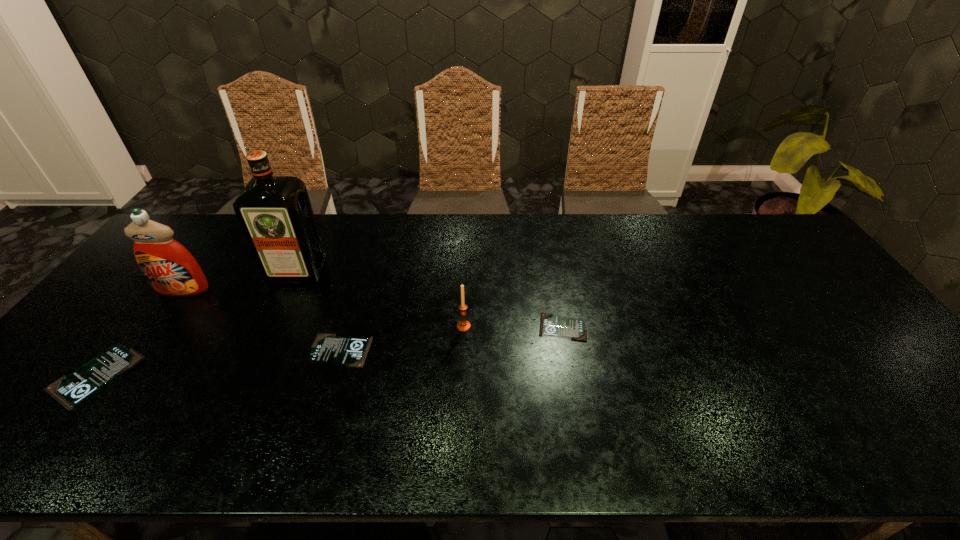
You are a GUI agent. You are given a task and a screenshot of the screen. Output one action in this format:
    pyautogui.click(x=<x>, y=<y>)
    Task: Click on the vacant area that lies between the leftmost identity card and the second object from right to left
    This screenshot has width=960, height=540.
    Given the screenshot: What is the action you would take?
    pyautogui.click(x=279, y=352)

Where is `vacant area between the rightmost identity card and the second shortest object`? The width and height of the screenshot is (960, 540). vacant area between the rightmost identity card and the second shortest object is located at coordinates (451, 339).

The height and width of the screenshot is (540, 960). Find the location of `free space between the detergent and the fourth shortest object`. free space between the detergent and the fourth shortest object is located at coordinates (324, 308).

I want to click on object that is the second closest to the second tallest identity card, so click(463, 325).

Identify which object is located as the fifth nearest to the leftmost identity card. Please provide its 2D coordinates. Your answer should be formatted as a tuple, i.e. [(x, y)], where the tuple contains the x and y coordinates of a point satisfying the conditions above.

[(550, 325)]

Select which identity card is the second closest to the second tallest identity card. Please provide its 2D coordinates. Your answer should be formatted as a tuple, i.e. [(x, y)], where the tuple contains the x and y coordinates of a point satisfying the conditions above.

[(550, 325)]

Locate which identity card ranks in proximity to the third object from left to right. Please provide its 2D coordinates. Your answer should be formatted as a tuple, i.e. [(x, y)], where the tuple contains the x and y coordinates of a point satisfying the conditions above.

[(327, 348)]

Where is `vacant space that satisfies the following two spatial constraints: 1. on the front label of the liquor; 2. on the right side of the shortest identity card`? This screenshot has width=960, height=540. vacant space that satisfies the following two spatial constraints: 1. on the front label of the liquor; 2. on the right side of the shortest identity card is located at coordinates (272, 327).

At what (x,y) coordinates should I click in order to perform the action: click on free space in the image that satisfies the following two spatial constraints: 1. on the front surface of the second object from right to left; 2. on the left side of the detergent. Please return your answer as a coordinate pair (x, y). Looking at the image, I should click on (156, 326).

The height and width of the screenshot is (540, 960). What are the coordinates of `vacant space that satisfies the following two spatial constraints: 1. on the back side of the leftmost identity card; 2. on the left side of the fourth shortest object` in the screenshot? It's located at (133, 326).